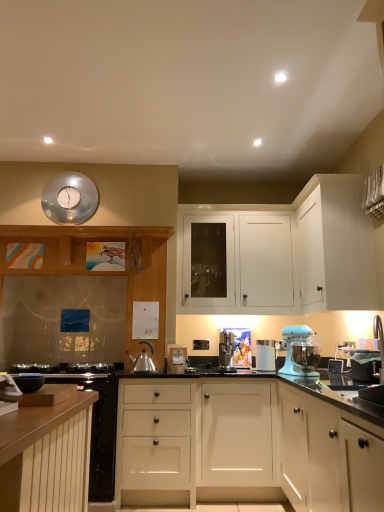
Locate an element on the screen. The image size is (384, 512). vacant area situated below metallic reflective clock at upper center (from a real-world perspective) is located at coordinates (61, 230).